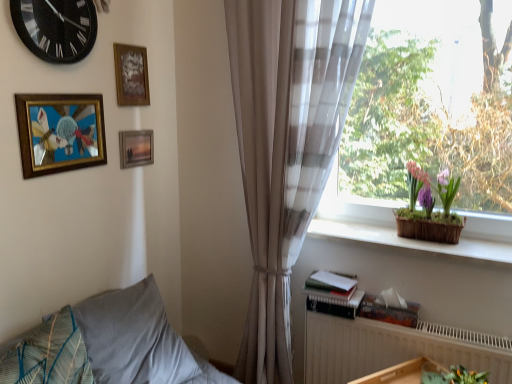
At what (x,y) coordinates should I click in order to perform the action: click on vacant area that is in front of matte brown pot at window. Please return your answer as a coordinate pair (x, y). Looking at the image, I should click on (452, 252).